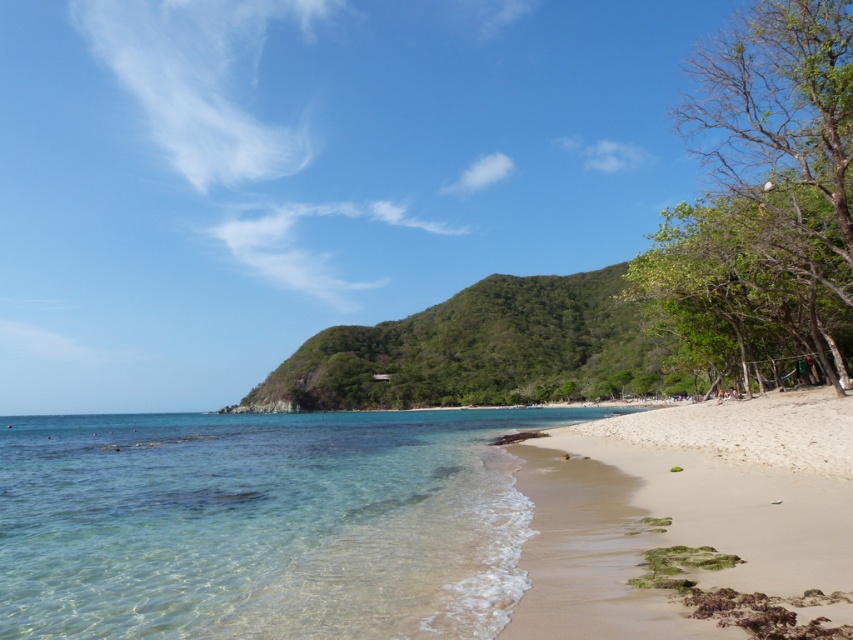
Can you confirm if sandy beach at lower right is positioned below white sandy beach at lower right?

No.

Does sandy beach at lower right lie in front of white sandy beach at lower right?

Yes, sandy beach at lower right is closer to the viewer.

I want to click on sandy beach at lower right, so click(x=683, y=512).

Which is below, clear water at lower left or sandy beach at lower right?

clear water at lower left is lower down.

Is clear water at lower left to the right of sandy beach at lower right from the viewer's perspective?

Incorrect, clear water at lower left is not on the right side of sandy beach at lower right.

You are a GUI agent. You are given a task and a screenshot of the screen. Output one action in this format:
    pyautogui.click(x=<x>, y=<y>)
    Task: Click on the clear water at lower left
    The width and height of the screenshot is (853, 640).
    Given the screenshot: What is the action you would take?
    pyautogui.click(x=263, y=524)

The height and width of the screenshot is (640, 853). Find the location of `clear water at lower left`. clear water at lower left is located at coordinates (263, 524).

Can you confirm if clear water at lower left is positioned above white sandy beach at lower right?

No.

Between clear water at lower left and white sandy beach at lower right, which one has less height?

white sandy beach at lower right is shorter.

Is point (460, 483) farther from viewer compared to point (805, 438)?

Yes, it is behind point (805, 438).

Where is `clear water at lower left`? clear water at lower left is located at coordinates (263, 524).